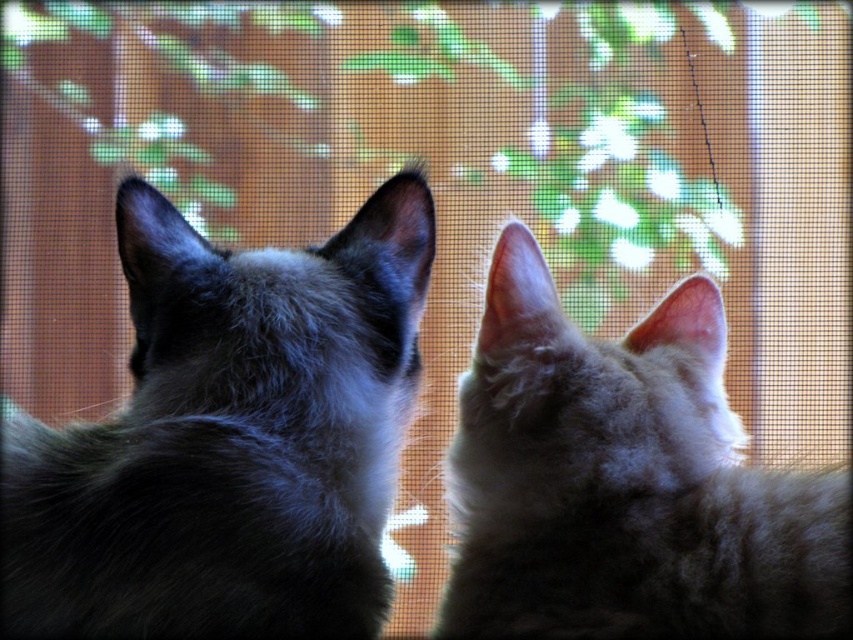
Is point (61, 566) behind point (540, 336)?

No, it is in front of (540, 336).

Is silky black cat at left to the left of fuzzy gray cat at center from the viewer's perspective?

Yes, silky black cat at left is to the left of fuzzy gray cat at center.

The width and height of the screenshot is (853, 640). Describe the element at coordinates (229, 438) in the screenshot. I see `silky black cat at left` at that location.

Locate an element on the screen. This screenshot has width=853, height=640. silky black cat at left is located at coordinates (229, 438).